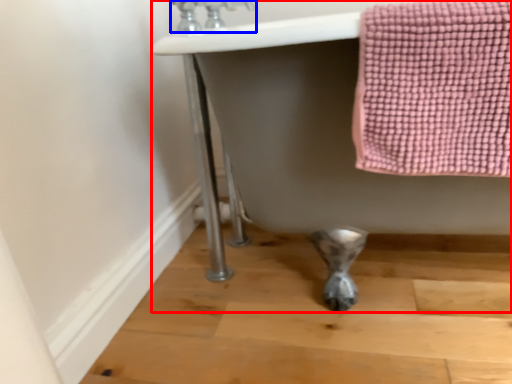
Question: Which of the following is the closest to the observer, bath (highlighted by a red box) or faucet (highlighted by a blue box)?

Choices:
 (A) bath
 (B) faucet

Answer: (A)